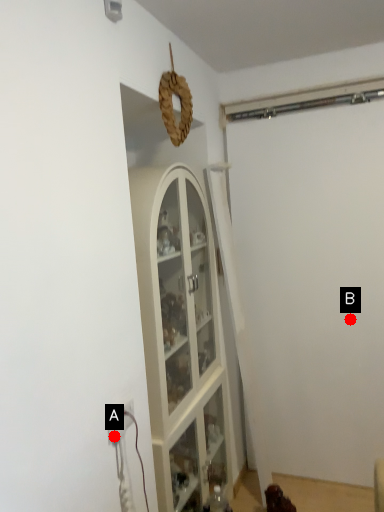
Question: Two points are circled on the image, labeled by A and B beside each circle. Which point appears closest to the camera in this image?

Choices:
 (A) A is closer
 (B) B is closer

Answer: (A)